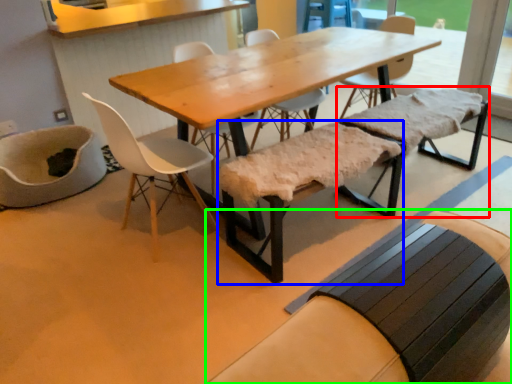
Question: Based on their relative distances, which object is farther from church bench (highlighted by a red box)? Choose from church bench (highlighted by a blue box) and church bench (highlighted by a green box).

Choices:
 (A) church bench
 (B) church bench

Answer: (B)